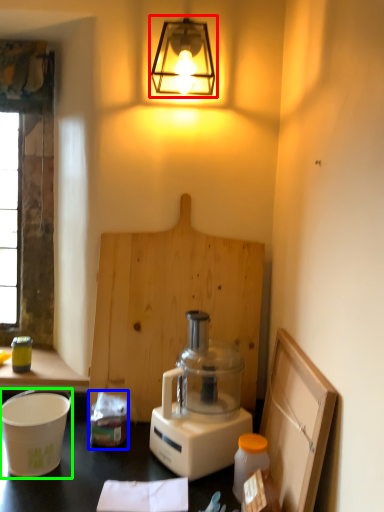
Question: Which object is the farthest from lamp (highlighted by a red box)? Choose among these: waste (highlighted by a blue box) or appliance (highlighted by a green box).

Choices:
 (A) waste
 (B) appliance

Answer: (B)